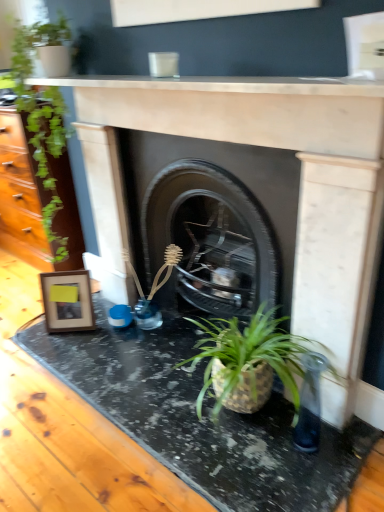
Locate an element on the screen. The height and width of the screenshot is (512, 384). empty space that is ontop of matte stone fireplace at center, which ranks as the first fireplace in front-to-back order (from a real-world perspective) is located at coordinates (194, 95).